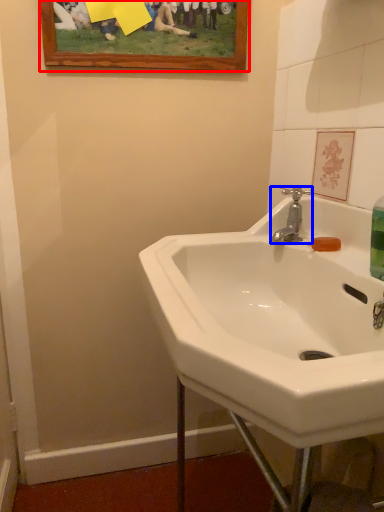
Question: Which object appears closest to the camera in this image, picture frame (highlighted by a red box) or tap (highlighted by a blue box)?

Choices:
 (A) picture frame
 (B) tap

Answer: (B)